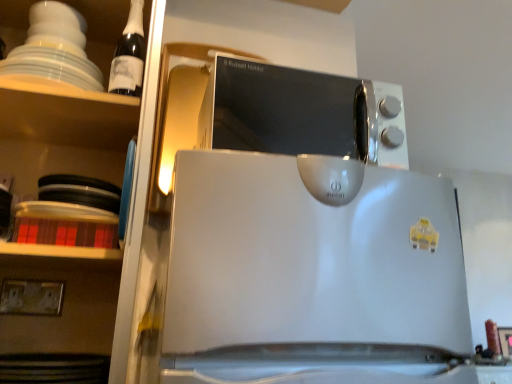
Question: From the image's perspective, is white glossy shelves at upper left located above white plastic electric outlet at lower left?

Choices:
 (A) no
 (B) yes

Answer: (B)

Question: From a real-world perspective, is white glossy shelves at upper left over white plastic electric outlet at lower left?

Choices:
 (A) no
 (B) yes

Answer: (B)

Question: Is white glossy shelves at upper left oriented away from white plastic electric outlet at lower left?

Choices:
 (A) no
 (B) yes

Answer: (B)

Question: Is the position of white glossy shelves at upper left more distant than that of white plastic electric outlet at lower left?

Choices:
 (A) yes
 (B) no

Answer: (B)

Question: Considering the relative sizes of white glossy shelves at upper left and white plastic electric outlet at lower left in the image provided, is white glossy shelves at upper left thinner than white plastic electric outlet at lower left?

Choices:
 (A) no
 (B) yes

Answer: (A)

Question: Looking at their shapes, would you say dark glass bottle at upper left is wider or thinner than white glossy shelves at upper left?

Choices:
 (A) wide
 (B) thin

Answer: (B)

Question: Is dark glass bottle at upper left bigger or smaller than white glossy shelves at upper left?

Choices:
 (A) big
 (B) small

Answer: (B)

Question: Is point (133, 21) closer or farther from the camera than point (99, 54)?

Choices:
 (A) closer
 (B) farther

Answer: (A)

Question: In the image, is dark glass bottle at upper left positioned in front of or behind white glossy shelves at upper left?

Choices:
 (A) behind
 (B) front

Answer: (A)

Question: From the image's perspective, relative to dark glass bottle at upper left, is white plastic electric outlet at lower left above or below?

Choices:
 (A) above
 (B) below

Answer: (B)

Question: Is white plastic electric outlet at lower left in front of or behind dark glass bottle at upper left in the image?

Choices:
 (A) front
 (B) behind

Answer: (B)

Question: From their relative heights in the image, would you say white plastic electric outlet at lower left is taller or shorter than dark glass bottle at upper left?

Choices:
 (A) short
 (B) tall

Answer: (A)

Question: Based on their positions, is white plastic electric outlet at lower left located to the left or right of dark glass bottle at upper left?

Choices:
 (A) right
 (B) left

Answer: (B)

Question: In the image, is satin silver microwave at upper center positioned in front of or behind white glossy shelves at upper left?

Choices:
 (A) behind
 (B) front

Answer: (A)

Question: From the image's perspective, is satin silver microwave at upper center positioned above or below white glossy shelves at upper left?

Choices:
 (A) below
 (B) above

Answer: (A)